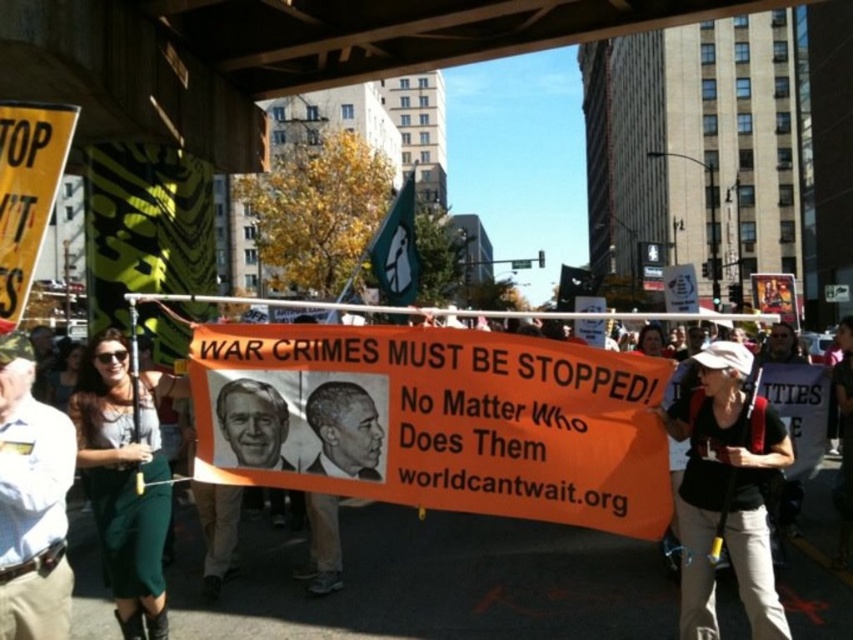
Where is `green fabric dress at left`? This screenshot has width=853, height=640. green fabric dress at left is located at coordinates (125, 477).

Does green fabric dress at left come behind smooth beige portrait at center?

Yes, it is behind smooth beige portrait at center.

In order to click on green fabric dress at left in this screenshot , I will do `click(125, 477)`.

Locate an element on the screen. Image resolution: width=853 pixels, height=640 pixels. green fabric dress at left is located at coordinates (125, 477).

Does orange fabric banner at center appear on the left side of smooth beige portrait at center?

In fact, orange fabric banner at center is to the right of smooth beige portrait at center.

Between point (317, 385) and point (241, 392), which one is positioned behind?

The point (241, 392) is more distant.

At what (x,y) coordinates should I click in order to perform the action: click on orange fabric banner at center. Please return your answer as a coordinate pair (x, y). Looking at the image, I should click on (434, 420).

Is orange fabric banner at center further to camera compared to green fabric dress at left?

No, orange fabric banner at center is closer to the viewer.

Who is taller, orange fabric banner at center or green fabric dress at left?

Standing taller between the two is green fabric dress at left.

Which is in front, point (425, 502) or point (131, 600)?

Point (425, 502) is in front.

Locate an element on the screen. This screenshot has width=853, height=640. orange fabric banner at center is located at coordinates (434, 420).